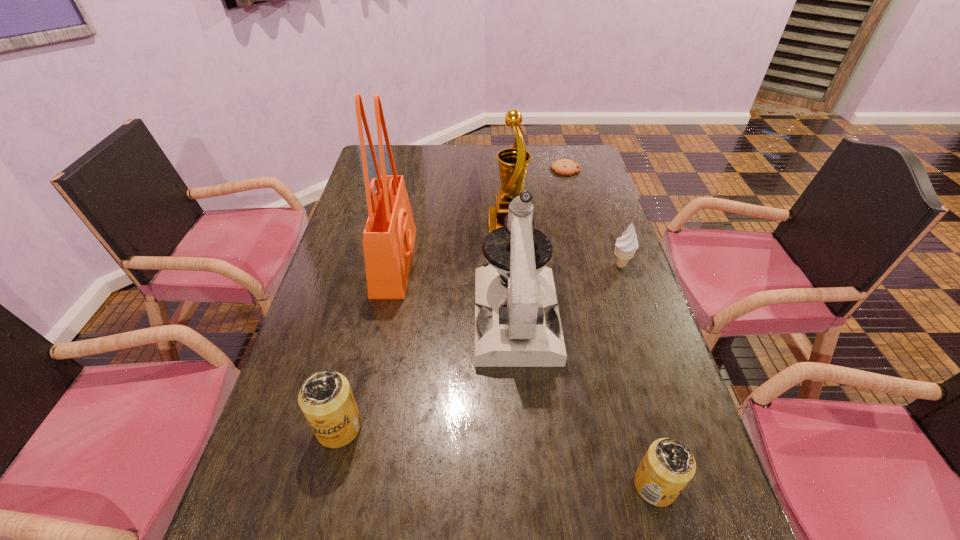
Where is `blank region between the sixth farthest object and the microscope`? The image size is (960, 540). blank region between the sixth farthest object and the microscope is located at coordinates (427, 372).

This screenshot has height=540, width=960. I want to click on object that can be found as the fourth closest to the rightmost object, so click(x=668, y=466).

The width and height of the screenshot is (960, 540). I want to click on the sixth closest object to the farther beer can, so click(565, 167).

You are a GUI agent. You are given a task and a screenshot of the screen. Output one action in this format:
    pyautogui.click(x=<x>, y=<y>)
    Task: Click on the vacant region that satisfies the following two spatial constraints: 1. on the logo side of the tote bag; 2. on the left side of the right beer can
    
    Given the screenshot: What is the action you would take?
    pyautogui.click(x=348, y=485)

Locate an element on the screen. This screenshot has width=960, height=540. free space that satisfies the following two spatial constraints: 1. on the front-facing side of the award; 2. at the eyepiece of the microscope is located at coordinates (516, 316).